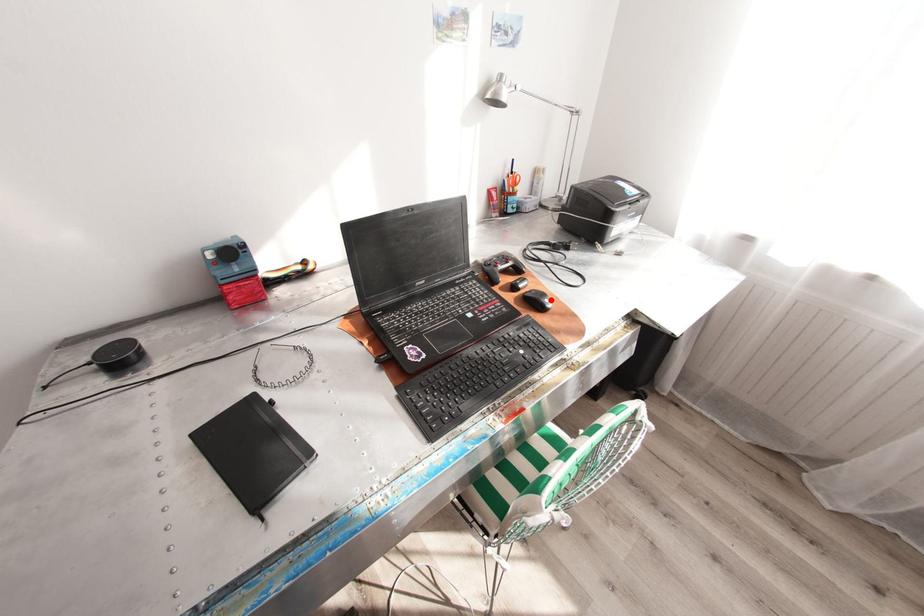
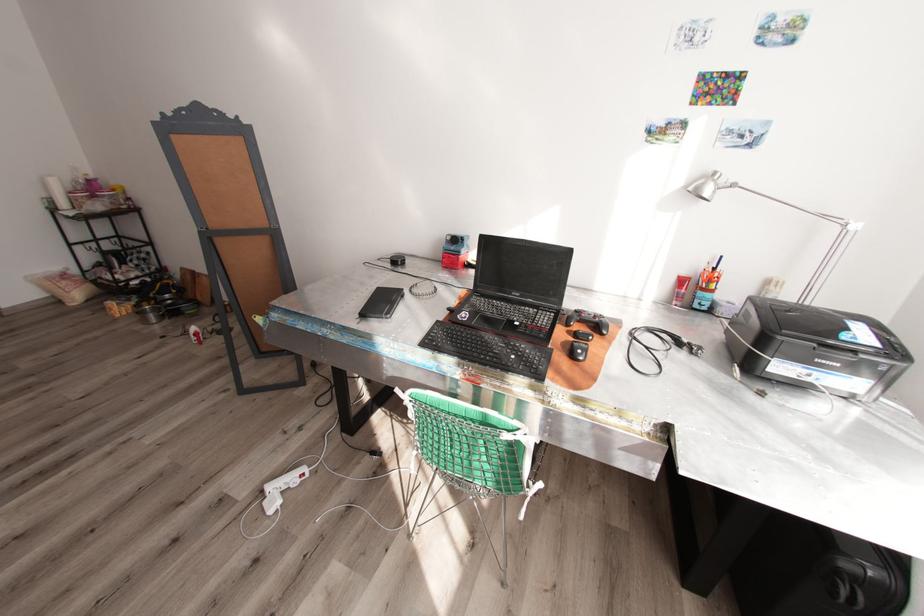
In the second image, find the point that corresponds to the highlighted location in the first image.

(584, 351)